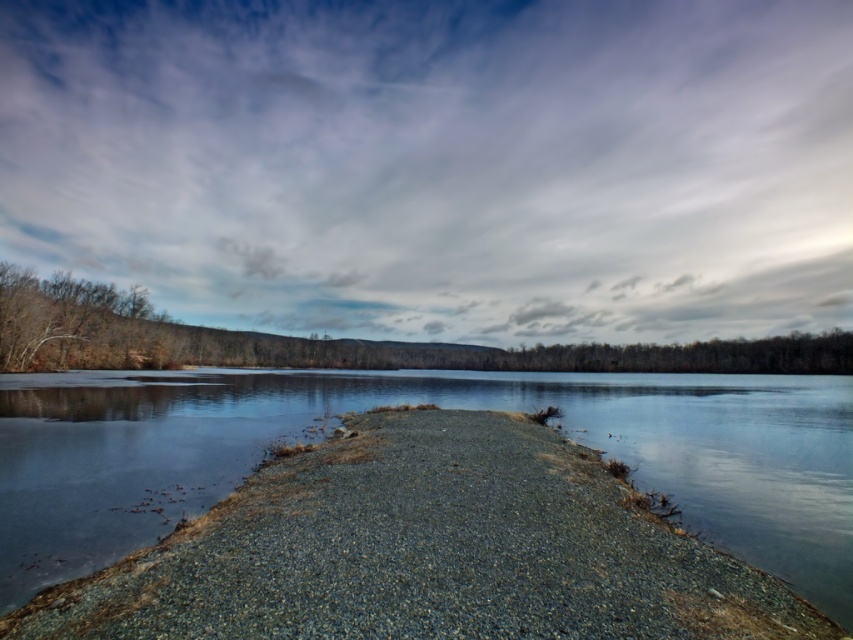
Which is more to the right, cloudy sky at upper center or clear water at center?

clear water at center is more to the right.

Is the position of cloudy sky at upper center more distant than that of clear water at center?

Yes.

From the picture: Measure the distance between point (418, 44) and camera.

The distance of point (418, 44) from camera is 251.32 meters.

The image size is (853, 640). What are the coordinates of `cloudy sky at upper center` in the screenshot? It's located at [x=439, y=164].